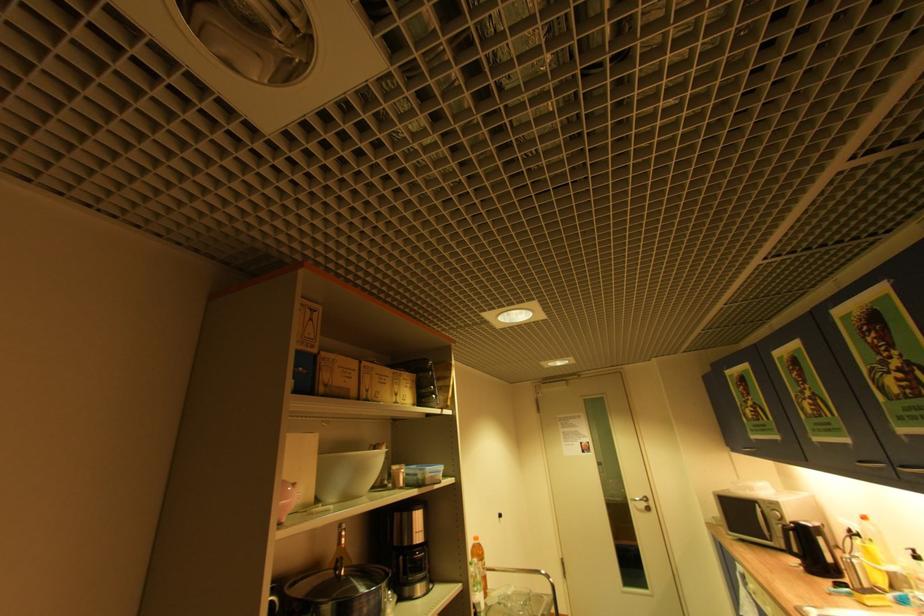
Find the location of a particular element. silver cabinet handle is located at coordinates (871, 464).